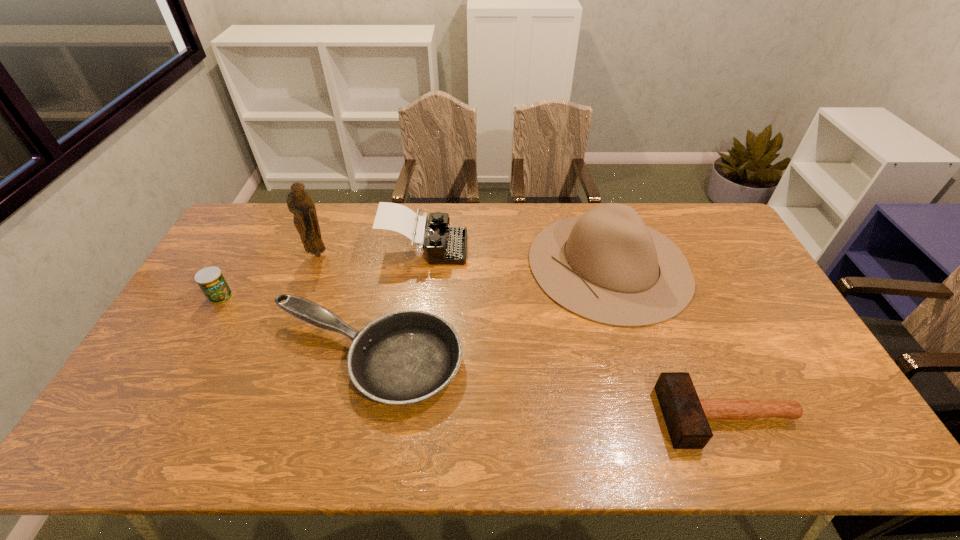
At what (x,y) coordinates should I click in order to perform the action: click on blank space located on the right of the frying pan. Please return your answer as a coordinate pair (x, y). Image resolution: width=960 pixels, height=540 pixels. Looking at the image, I should click on (591, 360).

This screenshot has width=960, height=540. Identify the location of free space located on the hammer head face of the mallet. (606, 416).

The height and width of the screenshot is (540, 960). I want to click on vacant space positioned 0.290m on the hammer head face of the mallet, so click(x=545, y=416).

This screenshot has width=960, height=540. What are the coordinates of `vacant space located 0.110m on the hammer head face of the mallet` in the screenshot? It's located at [618, 416].

Image resolution: width=960 pixels, height=540 pixels. In order to click on sombrero that is positioned at the far edge in this screenshot , I will do (607, 266).

The width and height of the screenshot is (960, 540). I want to click on typewriter that is at the far edge, so click(x=445, y=245).

Where is `object that is at the near edge`? object that is at the near edge is located at coordinates (686, 416).

The height and width of the screenshot is (540, 960). In order to click on object present at the left edge in this screenshot , I will do `click(211, 281)`.

Find the location of a particular element. Image resolution: width=960 pixels, height=540 pixels. object at the right edge is located at coordinates (686, 416).

Where is `object that is at the near right corner`? This screenshot has width=960, height=540. object that is at the near right corner is located at coordinates (686, 416).